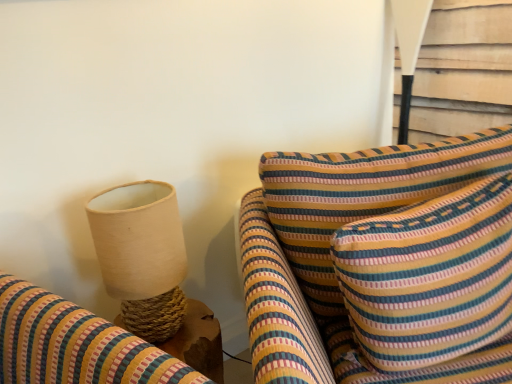
Question: Considering the relative sizes of striped fabric cushion at center and natural woven lampshade at left, which appears as the 2th table lamp when viewed from the back, in the image provided, is striped fabric cushion at center shorter than natural woven lampshade at left, which appears as the 2th table lamp when viewed from the back,?

Choices:
 (A) yes
 (B) no

Answer: (B)

Question: From the image's perspective, is striped fabric cushion at center located above natural woven lampshade at left, the 1th table lamp positioned from the left?

Choices:
 (A) yes
 (B) no

Answer: (B)

Question: Is striped fabric cushion at center smaller than natural woven lampshade at left, the second table lamp when ordered from right to left?

Choices:
 (A) yes
 (B) no

Answer: (B)

Question: Does striped fabric cushion at center have a lesser width compared to natural woven lampshade at left, arranged as the second table lamp when viewed from the top?

Choices:
 (A) no
 (B) yes

Answer: (A)

Question: Is striped fabric cushion at center further to the viewer compared to natural woven lampshade at left, which appears as the 2th table lamp when viewed from the back?

Choices:
 (A) yes
 (B) no

Answer: (B)

Question: From the image's perspective, is white fabric lampshade at upper right, positioned as the 2th table lamp in front-to-back order, above or below striped fabric cushion at center?

Choices:
 (A) above
 (B) below

Answer: (A)

Question: Is point (403, 16) positioned closer to the camera than point (441, 200)?

Choices:
 (A) closer
 (B) farther

Answer: (B)

Question: From a real-world perspective, relative to striped fabric cushion at center, is white fabric lampshade at upper right, the 2th table lamp positioned from the left, vertically above or below?

Choices:
 (A) above
 (B) below

Answer: (A)

Question: Would you say white fabric lampshade at upper right, which appears as the first table lamp when viewed from the back, is to the left or to the right of striped fabric cushion at center in the picture?

Choices:
 (A) left
 (B) right

Answer: (B)

Question: Would you say natural woven lampshade at left, positioned as the 1th table lamp in bottom-to-top order, is to the left or to the right of striped fabric cushion at center in the picture?

Choices:
 (A) left
 (B) right

Answer: (A)

Question: From a real-world perspective, relative to striped fabric cushion at center, is natural woven lampshade at left, the second table lamp when ordered from right to left, vertically above or below?

Choices:
 (A) above
 (B) below

Answer: (A)

Question: Considering the positions of natural woven lampshade at left, acting as the first table lamp starting from the front, and striped fabric cushion at center in the image, is natural woven lampshade at left, acting as the first table lamp starting from the front, taller or shorter than striped fabric cushion at center?

Choices:
 (A) tall
 (B) short

Answer: (B)

Question: From the image's perspective, is natural woven lampshade at left, positioned as the 1th table lamp in bottom-to-top order, above or below striped fabric cushion at center?

Choices:
 (A) below
 (B) above

Answer: (B)

Question: Considering the positions of striped fabric cushion at center and natural woven lampshade at left, acting as the first table lamp starting from the front, in the image, is striped fabric cushion at center wider or thinner than natural woven lampshade at left, acting as the first table lamp starting from the front,?

Choices:
 (A) thin
 (B) wide

Answer: (B)

Question: In terms of size, does striped fabric cushion at center appear bigger or smaller than natural woven lampshade at left, the 1th table lamp positioned from the left?

Choices:
 (A) small
 (B) big

Answer: (B)